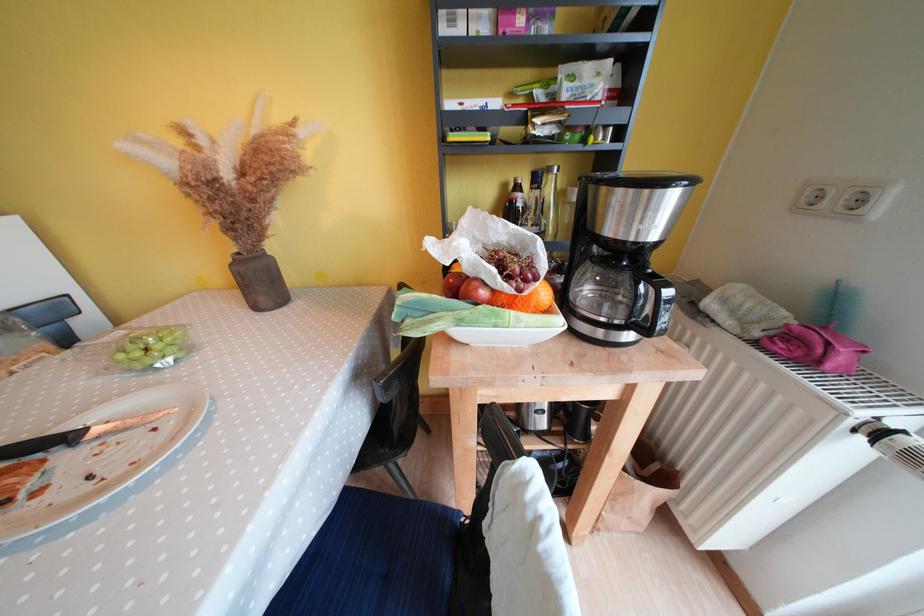
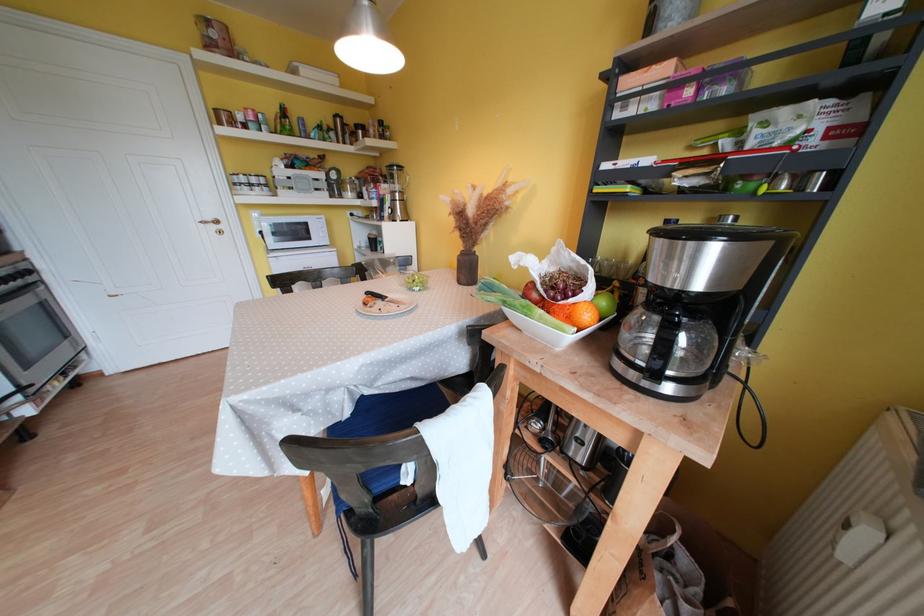
Where in the second image is the point corresponding to pixel 543 286 from the first image?

(578, 302)